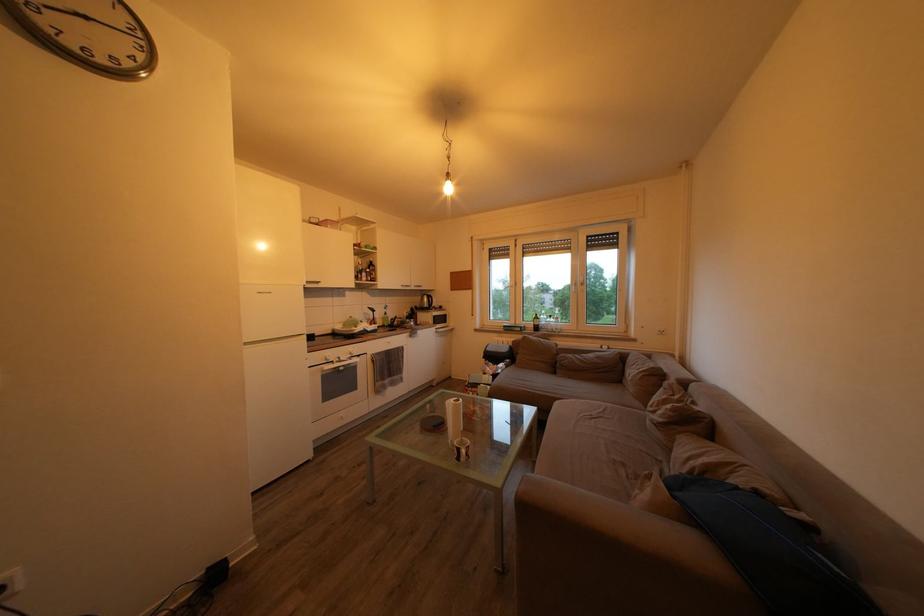
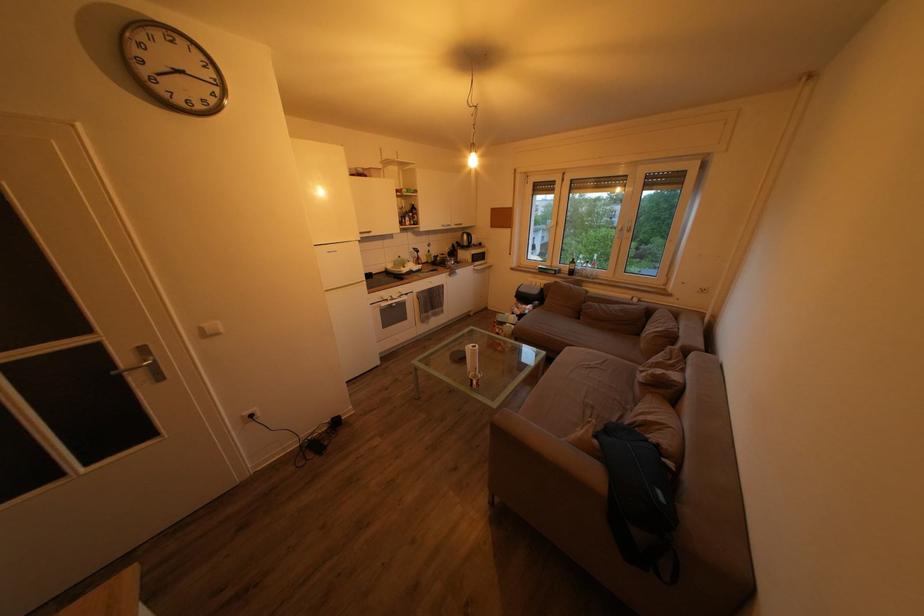
Question: The images are taken continuously from a first-person perspective. In which direction is your viewpoint rotating?

Choices:
 (A) Left
 (B) Right
 (C) Up
 (D) Down

Answer: (D)